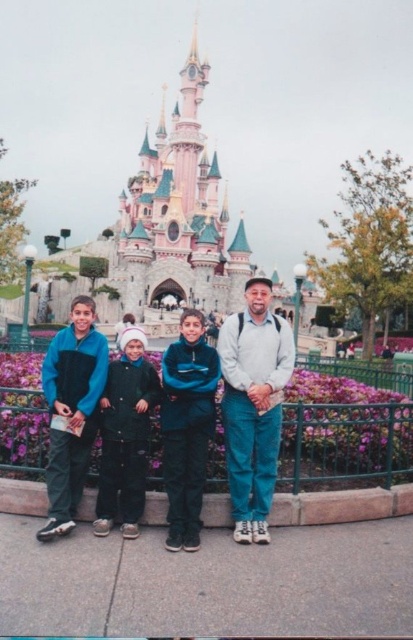
You are a photographer trying to capture a clear shot of the castle in the background. You notice two people wearing the blue fleece jacket at center and the light gray sweater at center are standing too close. To ensure the castle is the main focus, which clothing item should you ask to move forward so it doesn

The blue fleece jacket at center should move forward because it is positioned under the light gray sweater at center, meaning it is closer to the camera. Moving it forward would help it stand out less in front of the castle background.

You are a photographer trying to adjust the focus on your camera. You notice two items of clothing at the center of the image. Which clothing item is taller between the blue fleece jacket at center and the light gray sweater at center?

The blue fleece jacket at center is taller than the light gray sweater at center.

You are a photographer trying to decide where to place a new subject in the photo. The new subject is wearing a medium sized jacket. You have to place them between the blue fleece jacket at center and the light gray sweater at center. Which side should you place them on to maintain size consistency?

The blue fleece jacket at center is larger than the light gray sweater at center. To maintain size consistency, place the new subject with the medium sized jacket between them, closer to the light gray sweater at center so the sizes gradually decrease from largest to smallest.